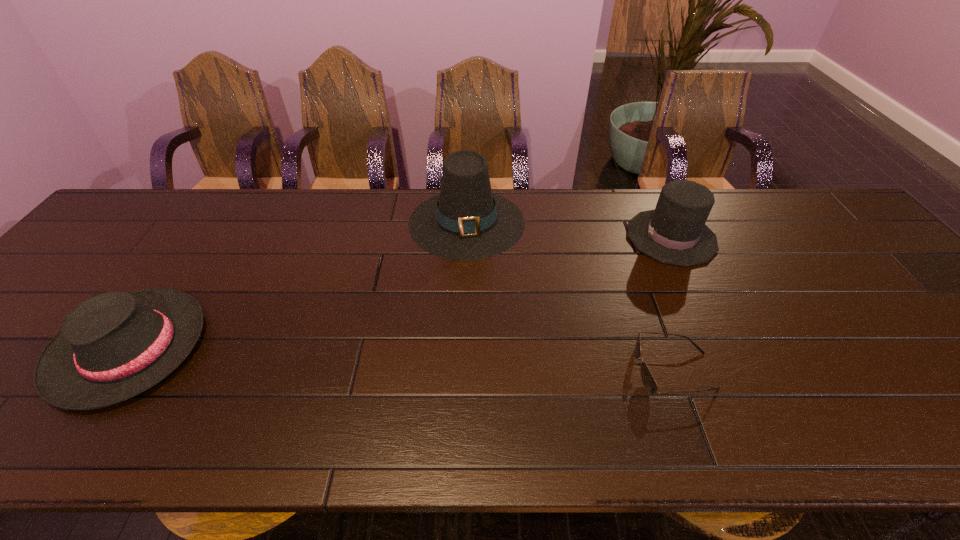
Locate an element on the screen. The height and width of the screenshot is (540, 960). free space located 0.330m on the front of the second tallest dress hat with the decoration is located at coordinates (513, 238).

Identify the location of vacant space situated 0.170m on the back of the leftmost object. Image resolution: width=960 pixels, height=540 pixels. (196, 251).

The width and height of the screenshot is (960, 540). What are the coordinates of `vacant space situated 0.060m on the front-facing side of the shortest object` in the screenshot? It's located at (608, 371).

Identify the location of vacant space located on the front-facing side of the shortest object. This screenshot has width=960, height=540. (571, 371).

You are a GUI agent. You are given a task and a screenshot of the screen. Output one action in this format:
    pyautogui.click(x=<x>, y=<y>)
    Task: Click on the free space located on the front-facing side of the shortest object
    The image size is (960, 540).
    Given the screenshot: What is the action you would take?
    coord(525,371)

Find the location of a particular element. This screenshot has height=540, width=960. object at the near edge is located at coordinates (113, 346).

Image resolution: width=960 pixels, height=540 pixels. Identify the location of object at the left edge. (113, 346).

This screenshot has width=960, height=540. I want to click on object present at the near left corner, so click(113, 346).

Locate an element on the screen. Image resolution: width=960 pixels, height=540 pixels. vacant space at the far edge of the desktop is located at coordinates tap(540, 230).

I want to click on vacant area at the near edge of the desktop, so click(772, 440).